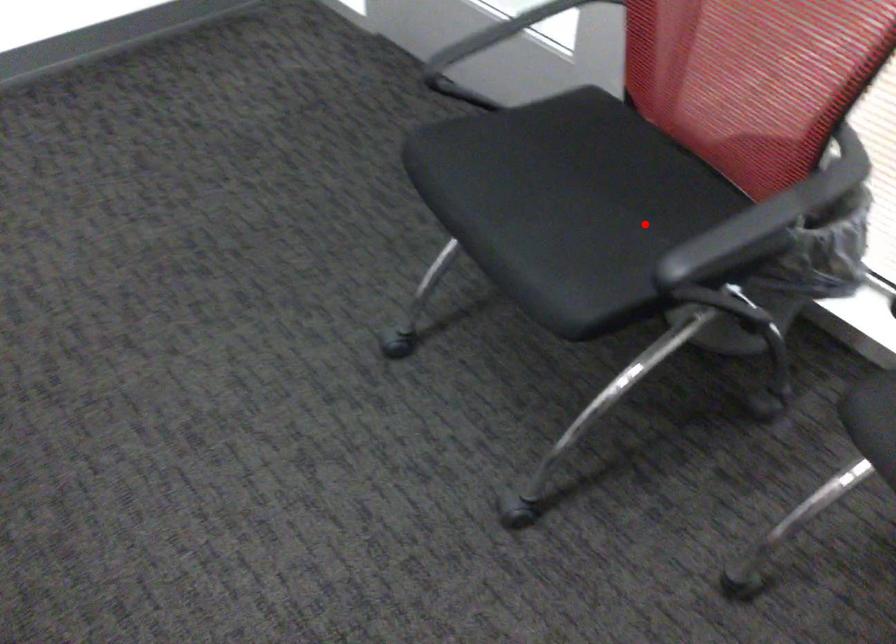
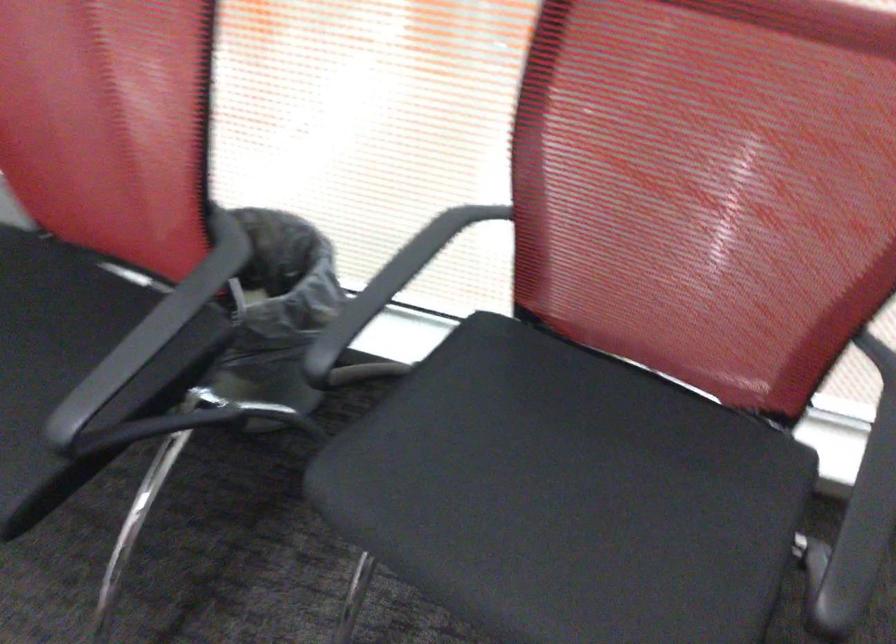
Where in the second image is the point corresponding to the highlighted location from the first image?

(73, 366)